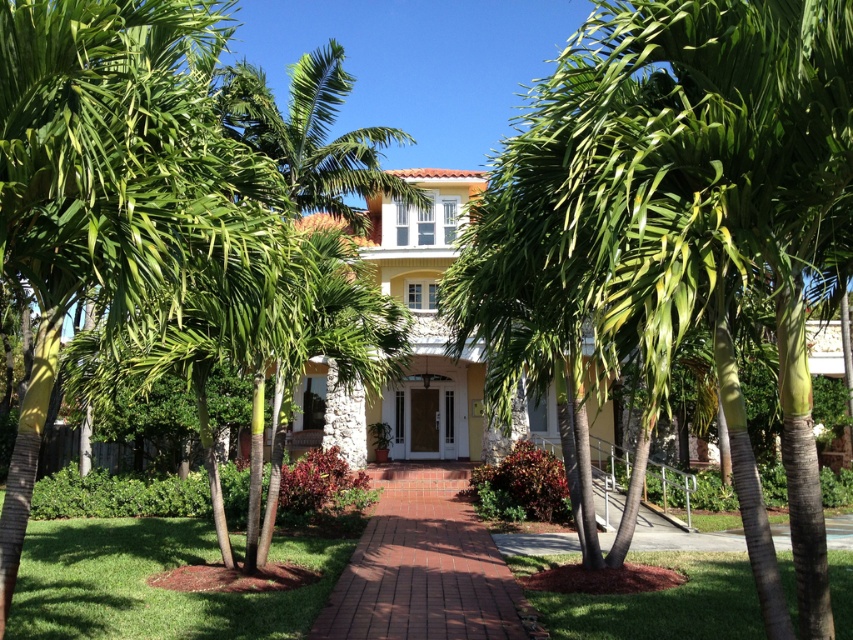
In the scene shown: You are standing at the center of the image. Which direction should you look to see the green leafy palm tree at left?

The green leafy palm tree at left is located at point (107, 179), so you should look to the left side of the image to see it.

You are standing at the base of the stairs leading to the house and looking towards the front door. Which palm tree, the green leafy palm tree at center or the green leafy palm tree at left, appears closer to the front door?

The green leafy palm tree at center appears closer to the front door because it is positioned above the green leafy palm tree at left, indicating it is in a more forward spatial position relative to the viewer.